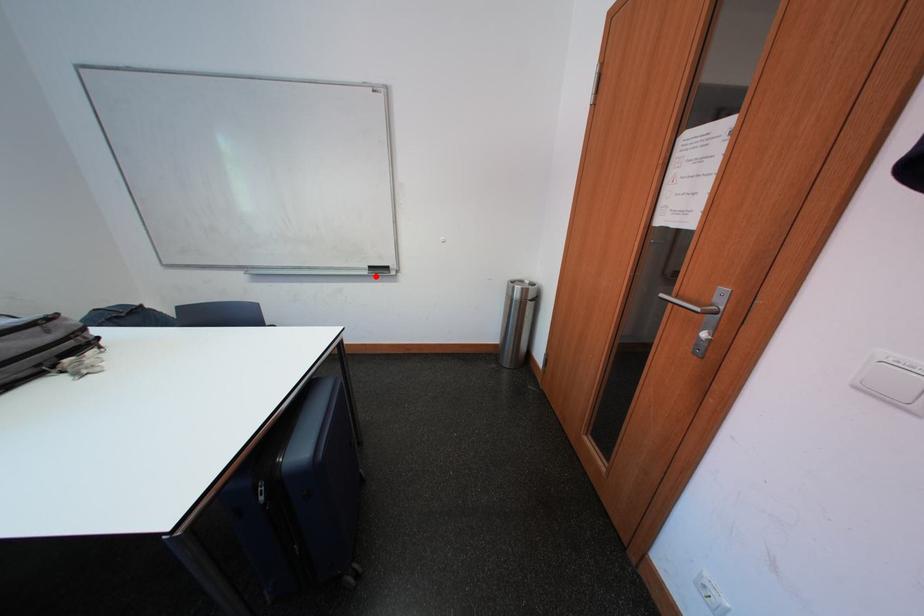
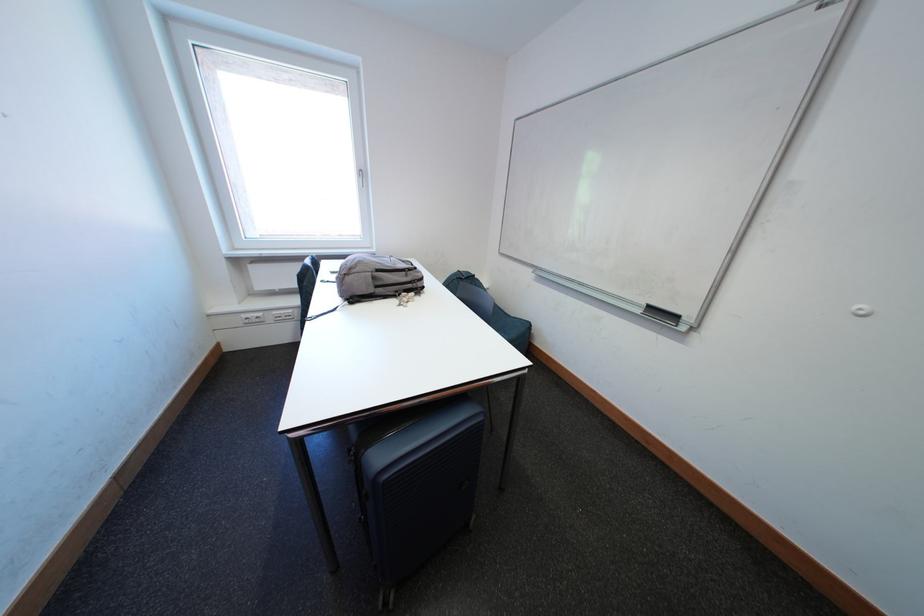
Find the pixel in the second image that matches the highlighted location in the first image.

(649, 315)